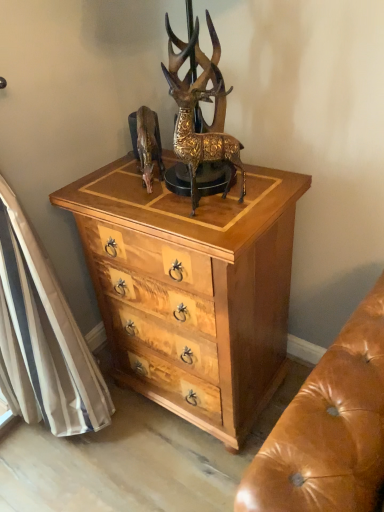
Locate an element on the screen. The image size is (384, 512). vacant region in front of gold textured deer at center is located at coordinates (219, 226).